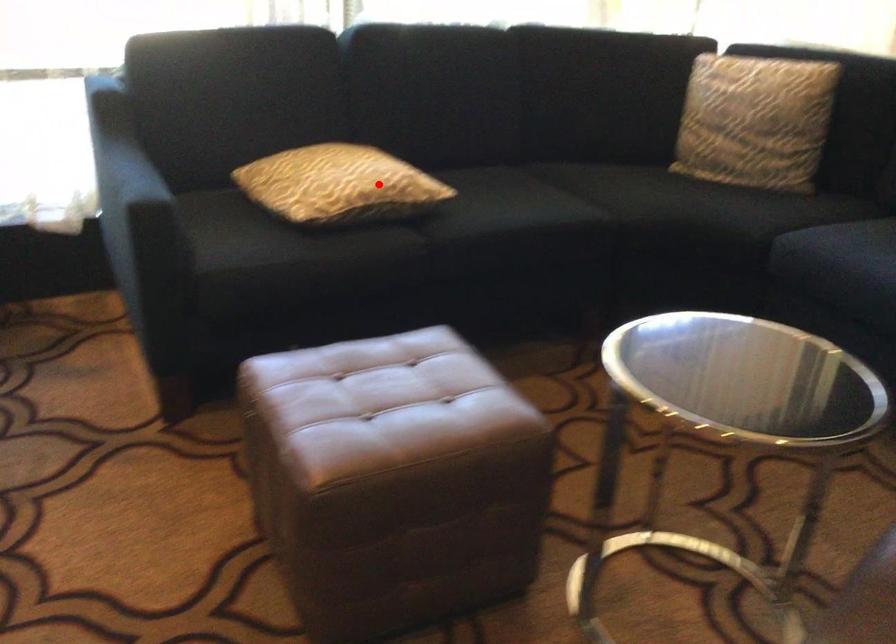
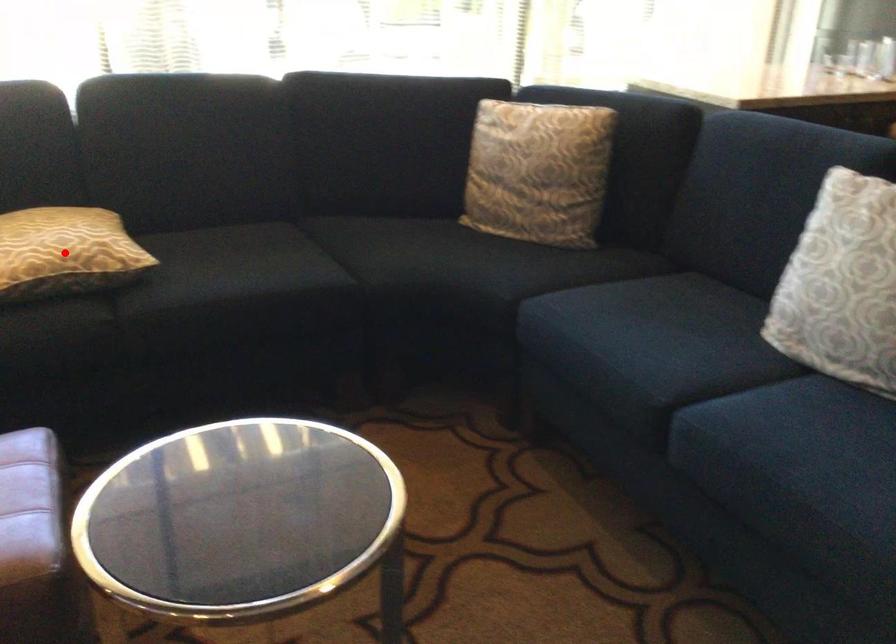
I am providing you with two images of the same scene from different viewpoints. A red point is marked on the first image and another point is marked on the second image. Is the red point in image1 aligned with the point shown in image2?

Yes